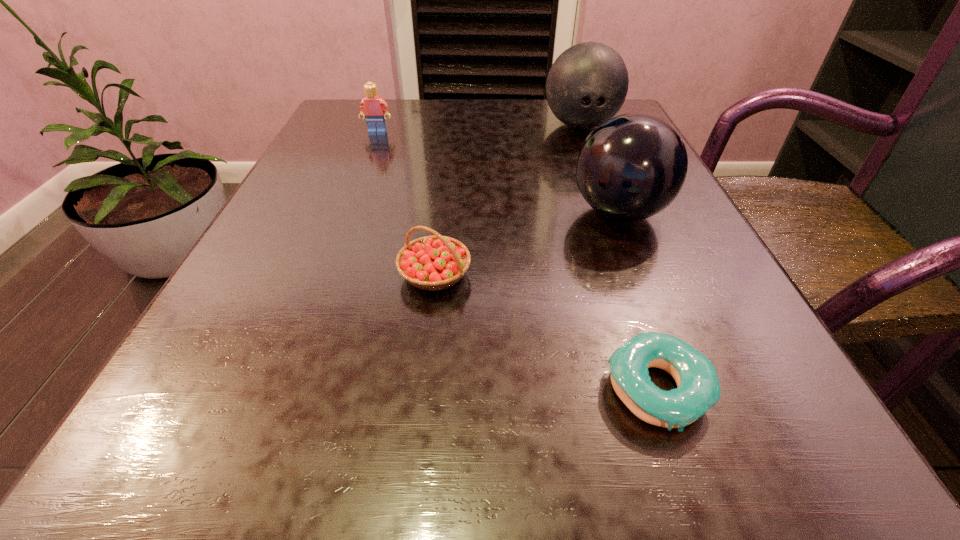
Identify the location of the farther bowling ball. This screenshot has width=960, height=540. (587, 84).

Image resolution: width=960 pixels, height=540 pixels. Identify the location of the third nearest object. (631, 167).

The width and height of the screenshot is (960, 540). I want to click on the third tallest object, so [372, 107].

This screenshot has width=960, height=540. I want to click on Lego, so click(x=372, y=107).

The width and height of the screenshot is (960, 540). Identify the location of the fourth object from right to left. (436, 262).

Identify the location of the second nearest object. (436, 262).

Locate an element on the screen. the shortest object is located at coordinates 698,389.

What are the coordinates of `the nearest object` in the screenshot? It's located at (698, 389).

Where is `vacant region located 0.310m on the grip area of the farther bowling ball`? Image resolution: width=960 pixels, height=540 pixels. vacant region located 0.310m on the grip area of the farther bowling ball is located at coordinates (622, 234).

Where is `vacant space situated 0.360m on the side of the third nearest object with the finger holes`? vacant space situated 0.360m on the side of the third nearest object with the finger holes is located at coordinates (353, 212).